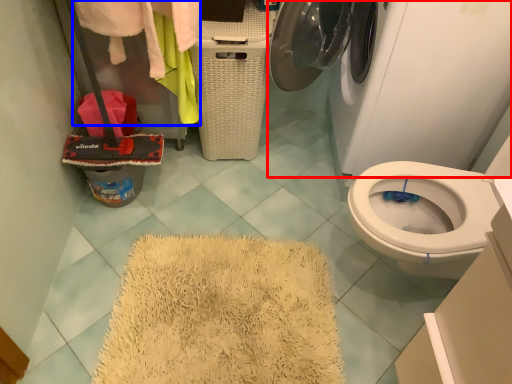
Question: Which object appears farthest to the camera in this image, washing machine (highlighted by a red box) or clothing (highlighted by a blue box)?

Choices:
 (A) washing machine
 (B) clothing

Answer: (B)